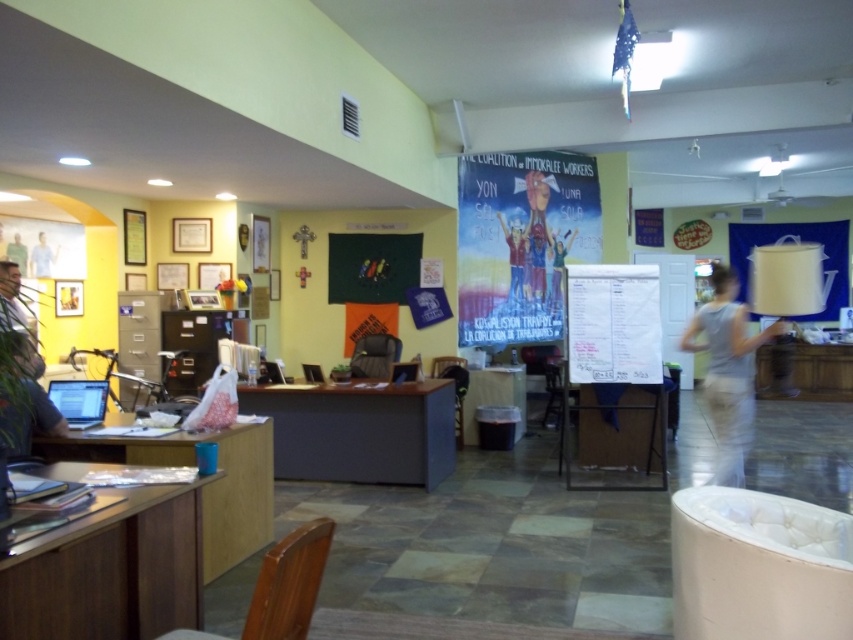
In the scene shown: Can you confirm if brown wood table at lower left is positioned to the left of matte black bulletin board at center?

Correct, you'll find brown wood table at lower left to the left of matte black bulletin board at center.

Does brown wood table at lower left appear under matte black bulletin board at center?

Yes.

Image resolution: width=853 pixels, height=640 pixels. I want to click on brown wood table at lower left, so click(x=109, y=570).

Identify the location of brown wood table at lower left. This screenshot has width=853, height=640. (109, 570).

Does matte dark wood table at center appear under wooden desk at lower left?

Indeed, matte dark wood table at center is positioned under wooden desk at lower left.

What do you see at coordinates (358, 429) in the screenshot? The image size is (853, 640). I see `matte dark wood table at center` at bounding box center [358, 429].

Is point (410, 429) farther from viewer compared to point (259, 465)?

Yes, point (410, 429) is farther from viewer.

Locate an element on the screen. The width and height of the screenshot is (853, 640). matte dark wood table at center is located at coordinates (358, 429).

Can you confirm if matte paper poster at center is shorter than light blue shirt at left?

No.

At what (x,y) coordinates should I click in order to perform the action: click on matte paper poster at center. Please return your answer as a coordinate pair (x, y). The height and width of the screenshot is (640, 853). Looking at the image, I should click on (521, 241).